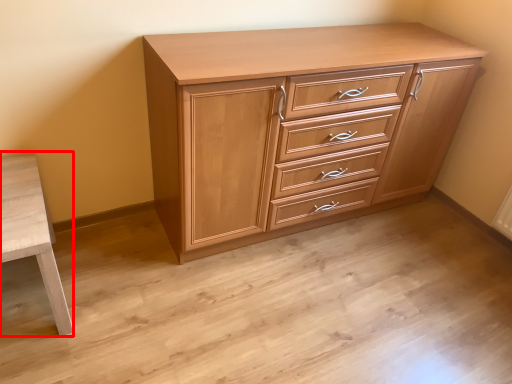
Question: In this image, where is table (annotated by the red box) located relative to chest of drawers?

Choices:
 (A) left
 (B) right

Answer: (A)